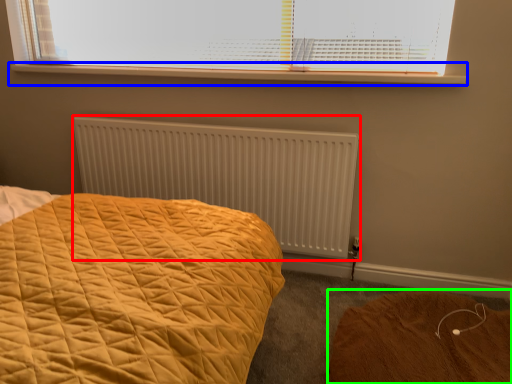
Question: Which object is positioned closest to radiator (highlighted by a red box)? Select from window sill (highlighted by a blue box) and plain (highlighted by a green box).

Choices:
 (A) window sill
 (B) plain

Answer: (A)